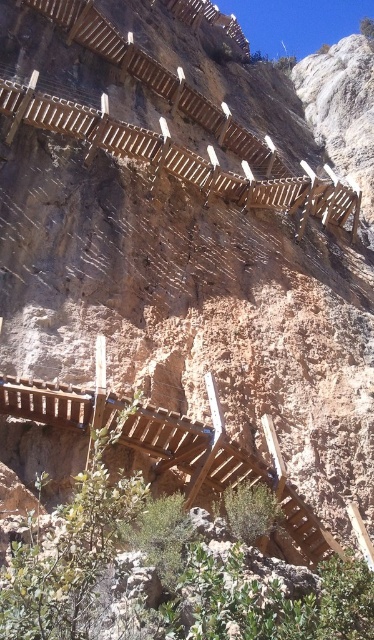
Who is more distant from viewer, (x=1, y=412) or (x=203, y=160)?

The point (x=203, y=160) is behind.

Can you confirm if brown wooden balustrade at center is positioned to the right of wooden at upper center?

No, brown wooden balustrade at center is not to the right of wooden at upper center.

Find the location of a particular element. The height and width of the screenshot is (640, 374). brown wooden balustrade at center is located at coordinates (191, 449).